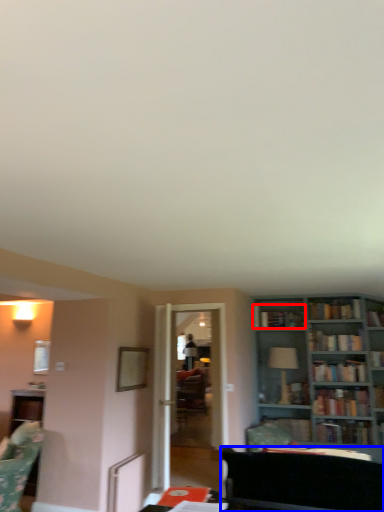
Question: Which point is closer to the camera, book (highlighted by a red box) or futon (highlighted by a blue box)?

Choices:
 (A) book
 (B) futon

Answer: (B)